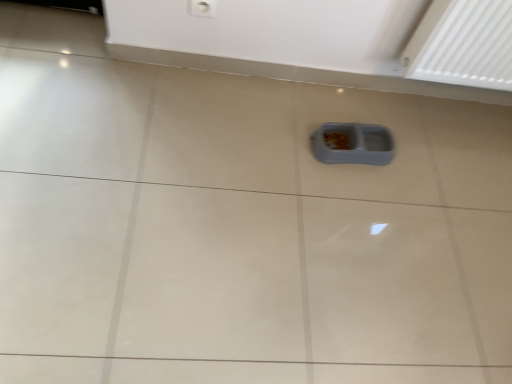
The height and width of the screenshot is (384, 512). What are the coordinates of `gray plastic food container at center` in the screenshot? It's located at (353, 144).

This screenshot has width=512, height=384. Describe the element at coordinates (353, 144) in the screenshot. I see `gray plastic food container at center` at that location.

Locate an element on the screen. white plastic electric outlet at upper center is located at coordinates (203, 8).

Measure the distance between white plastic electric outlet at upper center and camera.

1.35 meters.

The image size is (512, 384). Describe the element at coordinates (203, 8) in the screenshot. I see `white plastic electric outlet at upper center` at that location.

This screenshot has height=384, width=512. Find the location of `gray plastic food container at center`. gray plastic food container at center is located at coordinates (353, 144).

Considering the relative positions of white plastic electric outlet at upper center and gray plastic food container at center in the image provided, is white plastic electric outlet at upper center to the left or to the right of gray plastic food container at center?

Based on their positions, white plastic electric outlet at upper center is located to the left of gray plastic food container at center.

Which object is further away from the camera, white plastic electric outlet at upper center or gray plastic food container at center?

gray plastic food container at center is further from the camera.

Does point (209, 5) come in front of point (375, 140)?

That is True.

From the image's perspective, is white plastic electric outlet at upper center above or below gray plastic food container at center?

white plastic electric outlet at upper center is situated higher than gray plastic food container at center in the image.

Based on the photo, from a real-world perspective, which object stands above the other?

white plastic electric outlet at upper center is physically above.

Is white plastic electric outlet at upper center thinner than gray plastic food container at center?

Yes, white plastic electric outlet at upper center is thinner than gray plastic food container at center.

Between white plastic electric outlet at upper center and gray plastic food container at center, which one has less height?

Standing shorter between the two is gray plastic food container at center.

Does white plastic electric outlet at upper center have a smaller size compared to gray plastic food container at center?

Yes, white plastic electric outlet at upper center is smaller than gray plastic food container at center.

Which is correct: white plastic electric outlet at upper center is inside gray plastic food container at center, or outside of it?

white plastic electric outlet at upper center is spatially situated outside gray plastic food container at center.

Is white plastic electric outlet at upper center in contact with gray plastic food container at center?

No, white plastic electric outlet at upper center is not touching gray plastic food container at center.

Is white plastic electric outlet at upper center facing towards gray plastic food container at center?

No.

Can you tell me how much white plastic electric outlet at upper center and gray plastic food container at center differ in facing direction?

white plastic electric outlet at upper center and gray plastic food container at center are facing 3.45 degrees away from each other.

In the image, there is a gray plastic food container at center. At what (x,y) coordinates should I click in order to perform the action: click on electric outlet above it (from the image's perspective). Please return your answer as a coordinate pair (x, y). Looking at the image, I should click on (203, 8).

In the image, is gray plastic food container at center on the left side or the right side of white plastic electric outlet at upper center?

gray plastic food container at center is to the right of white plastic electric outlet at upper center.

Who is more distant, gray plastic food container at center or white plastic electric outlet at upper center?

Positioned behind is gray plastic food container at center.

Which is farther from the camera, (351, 139) or (208, 15)?

Positioned behind is point (351, 139).

From the image's perspective, between gray plastic food container at center and white plastic electric outlet at upper center, which one is located above?

white plastic electric outlet at upper center.

From a real-world perspective, is gray plastic food container at center positioned above or below white plastic electric outlet at upper center?

Clearly, from a real-world perspective, gray plastic food container at center is below white plastic electric outlet at upper center.

Between gray plastic food container at center and white plastic electric outlet at upper center, which one has smaller width?

Thinner between the two is white plastic electric outlet at upper center.

Which of these two, gray plastic food container at center or white plastic electric outlet at upper center, stands shorter?

gray plastic food container at center.

In the scene shown: Between gray plastic food container at center and white plastic electric outlet at upper center, which one has larger size?

With larger size is gray plastic food container at center.

Is gray plastic food container at center outside of white plastic electric outlet at upper center?

Yes, gray plastic food container at center is located beyond the bounds of white plastic electric outlet at upper center.

Would you consider gray plastic food container at center to be distant from white plastic electric outlet at upper center?

They are positioned close to each other.

Is gray plastic food container at center aimed at white plastic electric outlet at upper center?

No, gray plastic food container at center is not aimed at white plastic electric outlet at upper center.

Can you tell me how much gray plastic food container at center and white plastic electric outlet at upper center differ in facing direction?

gray plastic food container at center and white plastic electric outlet at upper center are facing 3.45 degrees away from each other.

Where is `electric outlet above the gray plastic food container at center (from the image's perspective)`? Image resolution: width=512 pixels, height=384 pixels. electric outlet above the gray plastic food container at center (from the image's perspective) is located at coordinates (203, 8).

You are a GUI agent. You are given a task and a screenshot of the screen. Output one action in this format:
    pyautogui.click(x=<x>, y=<y>)
    Task: Click on the waste container that appears below the white plastic electric outlet at upper center (from a real-world perspective)
    This screenshot has height=384, width=512.
    Given the screenshot: What is the action you would take?
    pyautogui.click(x=353, y=144)

Identify the location of electric outlet above the gray plastic food container at center (from a real-world perspective). (203, 8).